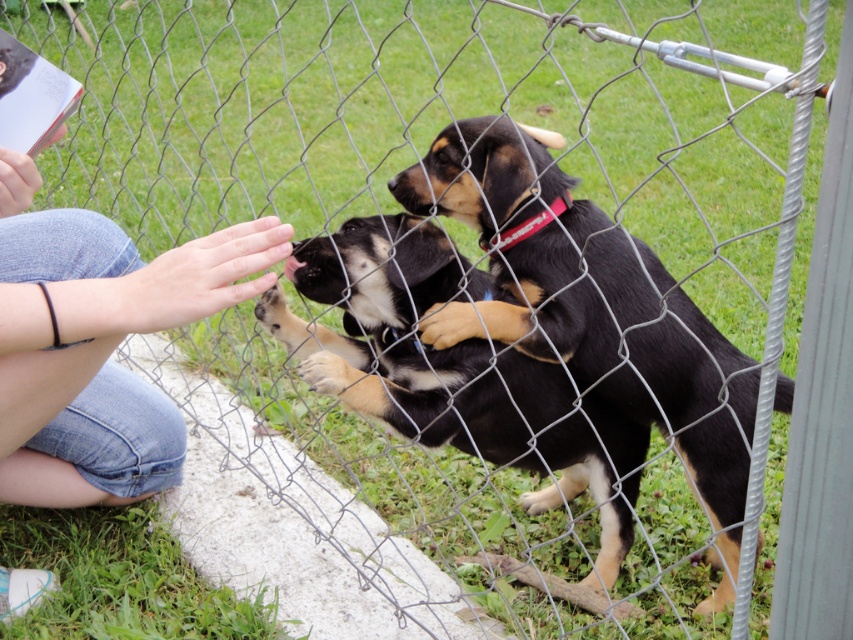
You are a dog trainer trying to identify the older puppy between the black fur puppy at center and the black fur dog at center. Based on their sizes, which one is likely older?

The black fur puppy at center is much taller than the black fur dog at center, so the black fur puppy at center is likely older since it is taller.

You are a drone operator trying to capture a photo of the two puppies and the person. You need to position your drone between the two points marked as point [120,280] and point [397,179]. Which point should the drone be closer to in order to frame the puppies and the person clearly?

The drone should be positioned closer to point [120,280] because it is in front of point [397,179], allowing for a clearer view of the puppies and the person.

From the picture: You are a dog trainer observing the scene. The person is sitting on the grass and has their hand near the puppies. Where is the jeans at left in relation to the black smooth nose at center?

The jeans at left is below the black smooth nose at center.